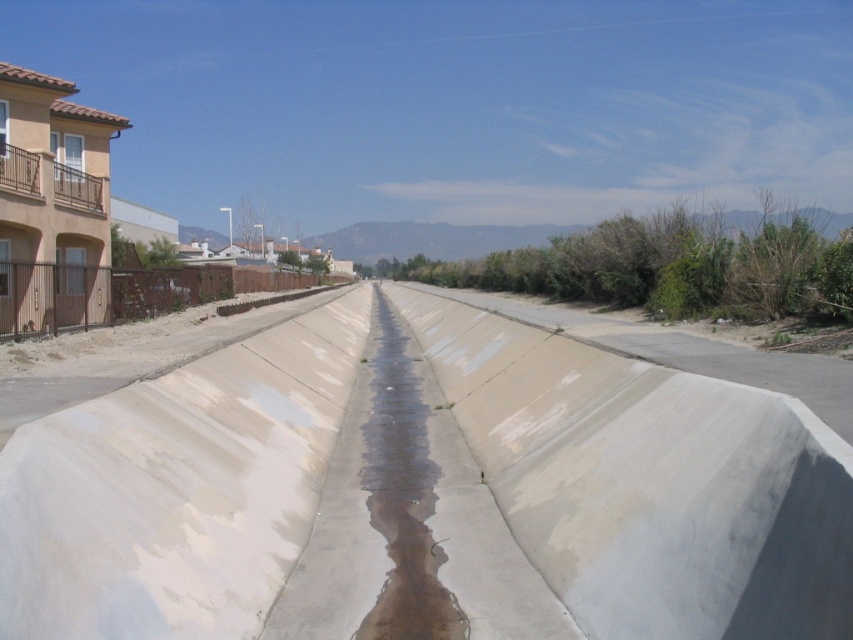
You are a delivery robot that needs to cross the drainage canal shown in the image. You have two paths available at the center of the canal. One is the smooth concrete at center and the other is the clear concrete puddle at center. Which path should you choose to ensure stable footing?

You should choose the smooth concrete at center because it is positioned over the clear concrete puddle at center, providing a solid surface for stable footing.

You need to cross the drainage canal but only have a 1.2 meter wide plank. The smooth concrete at center and clear concrete puddle at center are both in the middle. Which part of the canal can you safely place your plank on?

The smooth concrete at center has a larger width than the clear concrete puddle at center, so placing the plank on the smooth concrete at center would be safer since it can accommodate the plank width of 1.2 meters.